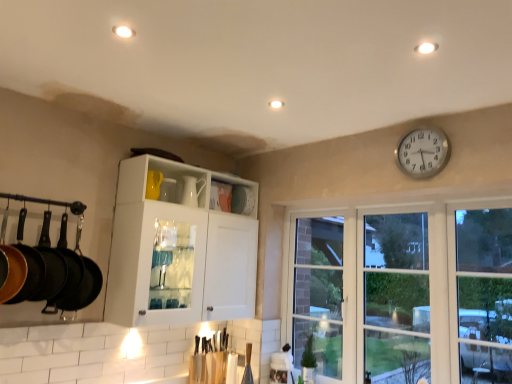
Question: From a real-world perspective, is white metallic clock at upper right positioned above or below white glossy cabinet at center?

Choices:
 (A) below
 (B) above

Answer: (B)

Question: From the image's perspective, is white metallic clock at upper right positioned above or below white glossy cabinet at center?

Choices:
 (A) above
 (B) below

Answer: (A)

Question: Which of these objects is positioned closest to the gold matte frying pan at left, which is the 4th frying pan from back to front?

Choices:
 (A) matte black frying pan at left, which ranks as the 2th frying pan in back-to-front order
 (B) transparent glass window at right
 (C) white metallic clock at upper right
 (D) white glossy cabinet at center
 (E) black cast iron frying pan at left, positioned as the 4th frying pan in front-to-back order

Answer: (A)

Question: Which object is positioned closest to the white metallic clock at upper right?

Choices:
 (A) transparent glass window at right
 (B) black cast iron frying pan at left, positioned as the 4th frying pan in front-to-back order
 (C) matte black frying pan at left, which ranks as the 2th frying pan in back-to-front order
 (D) gold matte frying pan at left, which is the 1th frying pan from front to back
 (E) white glossy cabinet at center

Answer: (A)